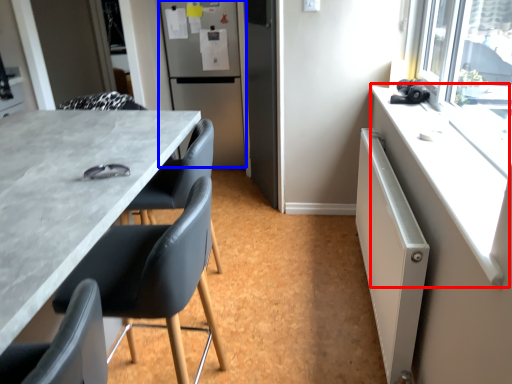
Question: Among these objects, which one is farthest to the camera, counter top (highlighted by a red box) or refrigerator (highlighted by a blue box)?

Choices:
 (A) counter top
 (B) refrigerator

Answer: (B)